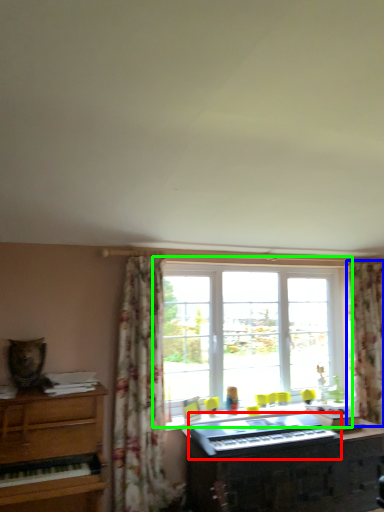
Question: Estimate the real-world distances between objects in this image. Which object is farther from musical keyboard (highlighted by a red box), curtain (highlighted by a blue box) or window (highlighted by a green box)?

Choices:
 (A) curtain
 (B) window

Answer: (A)